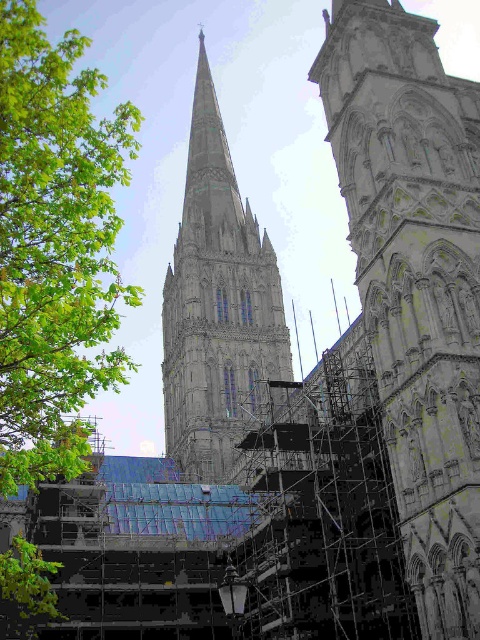
Between green leafy tree at left and stone steeple at center, which one appears on the right side from the viewer's perspective?

stone steeple at center

Does green leafy tree at left have a smaller size compared to stone steeple at center?

Incorrect, green leafy tree at left is not smaller in size than stone steeple at center.

Who is more forward, (57, 246) or (265, 397)?

Positioned in front is point (57, 246).

Find the location of a particular element. The height and width of the screenshot is (640, 480). green leafy tree at left is located at coordinates point(55,246).

Does white stone tower at center have a greater width compared to green leafy tree at left?

Incorrect, white stone tower at center's width does not surpass green leafy tree at left's.

Identify the location of white stone tower at center. (x=415, y=280).

Find the location of `white stone tower at center`. white stone tower at center is located at coordinates coord(415,280).

Can you confirm if white stone tower at center is wider than stone steeple at center?

No.

Can you confirm if white stone tower at center is positioned above stone steeple at center?

No.

You are a GUI agent. You are given a task and a screenshot of the screen. Output one action in this format:
    pyautogui.click(x=<x>, y=<y>)
    Task: Click on the white stone tower at center
    
    Given the screenshot: What is the action you would take?
    pyautogui.click(x=415, y=280)